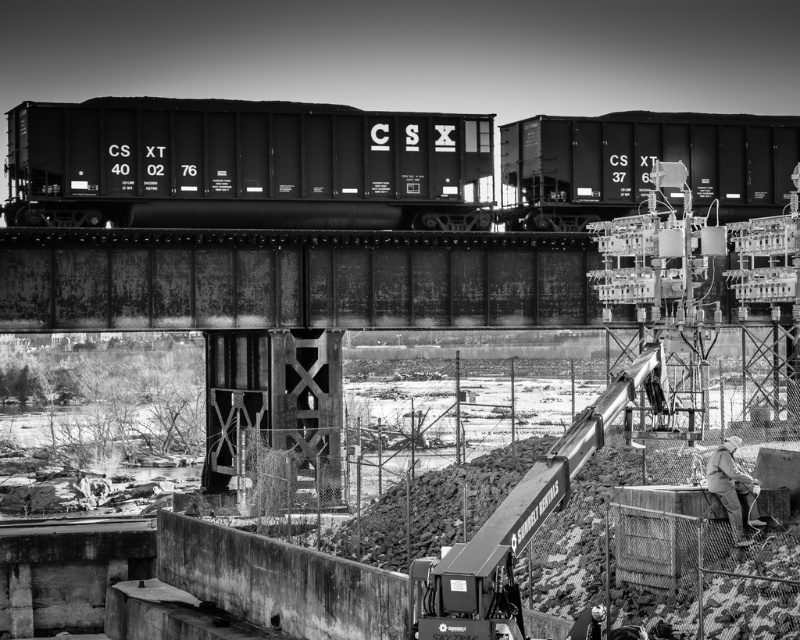
Question: Is matte black train car at center above matte black train car at upper right?

Choices:
 (A) yes
 (B) no

Answer: (A)

Question: Observing the image, what is the correct spatial positioning of matte black train car at center in reference to khaki fabric jacket at lower right?

Choices:
 (A) below
 (B) above

Answer: (B)

Question: Which point is farther to the camera?

Choices:
 (A) [x=350, y=184]
 (B) [x=724, y=506]

Answer: (A)

Question: Estimate the real-world distances between objects in this image. Which object is farther from the matte black train car at center?

Choices:
 (A) khaki fabric jacket at lower right
 (B) matte black train car at upper right

Answer: (A)

Question: Which of the following is the farthest from the observer?

Choices:
 (A) (417, 214)
 (B) (724, 445)
 (C) (762, 186)

Answer: (C)

Question: Does matte black train car at upper right have a smaller size compared to khaki fabric jacket at lower right?

Choices:
 (A) yes
 (B) no

Answer: (B)